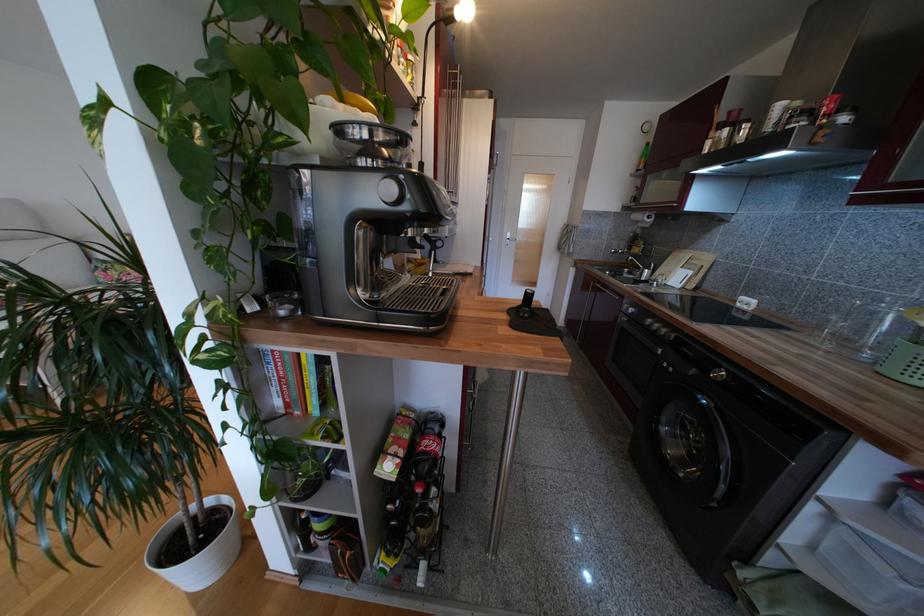
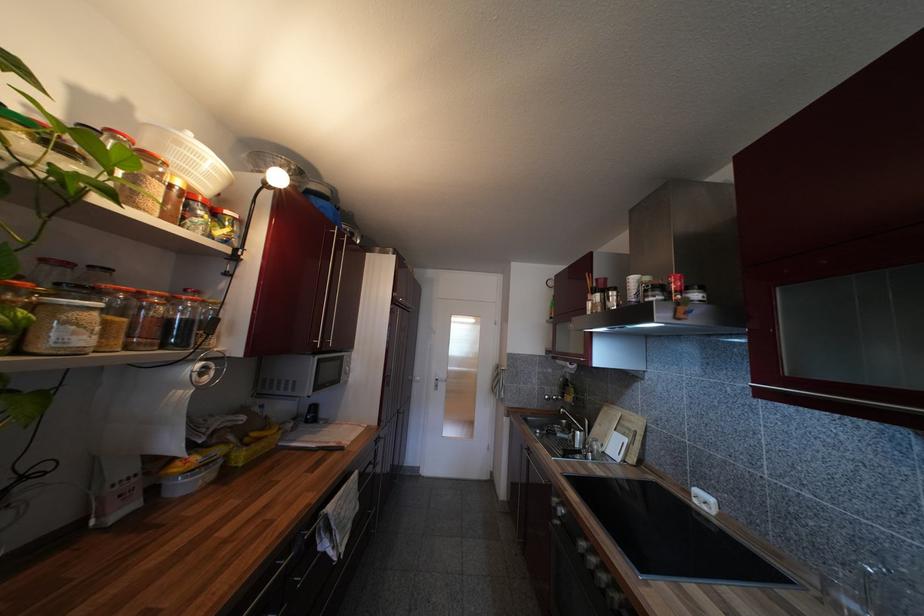
Where in the second image is the point corresponding to (x=628, y=310) from the first image?

(557, 507)